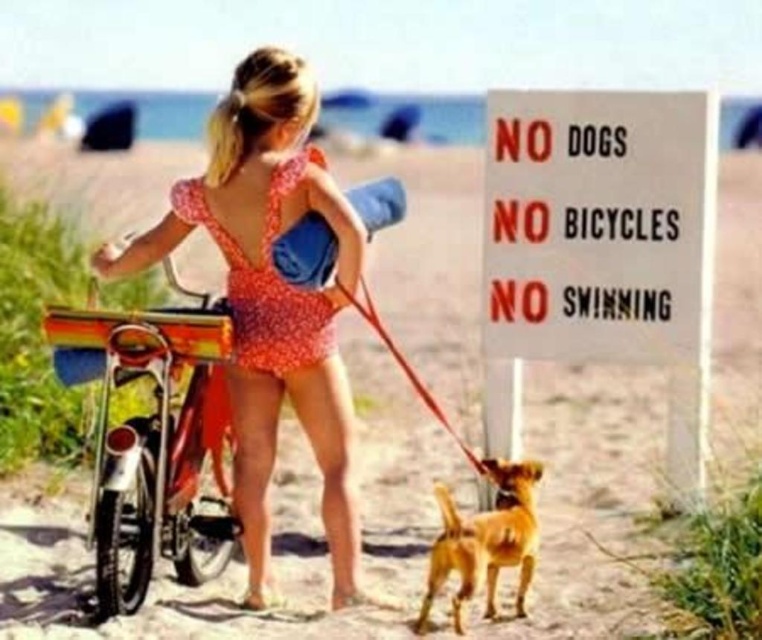
Which is below, shiny chrome bicycle at center or red nylon leash at center?

shiny chrome bicycle at center is below.

This screenshot has width=762, height=640. Describe the element at coordinates (152, 440) in the screenshot. I see `shiny chrome bicycle at center` at that location.

This screenshot has width=762, height=640. Find the location of `shiny chrome bicycle at center`. shiny chrome bicycle at center is located at coordinates (152, 440).

Is white paper sign at center below shiny chrome bicycle at center?

Incorrect, white paper sign at center is not positioned below shiny chrome bicycle at center.

Can you confirm if white paper sign at center is smaller than shiny chrome bicycle at center?

Yes, white paper sign at center is smaller than shiny chrome bicycle at center.

Is point (652, 289) less distant than point (181, 324)?

No, (652, 289) is behind (181, 324).

At what (x,y) coordinates should I click in order to perform the action: click on white paper sign at center. Please return your answer as a coordinate pair (x, y). Image resolution: width=762 pixels, height=640 pixels. Looking at the image, I should click on (600, 248).

Is white paper sign at center to the right of red nylon leash at center from the viewer's perspective?

Yes, white paper sign at center is to the right of red nylon leash at center.

Does white paper sign at center have a lesser height compared to red nylon leash at center?

In fact, white paper sign at center may be taller than red nylon leash at center.

The height and width of the screenshot is (640, 762). Describe the element at coordinates (600, 248) in the screenshot. I see `white paper sign at center` at that location.

What are the coordinates of `white paper sign at center` in the screenshot? It's located at (600, 248).